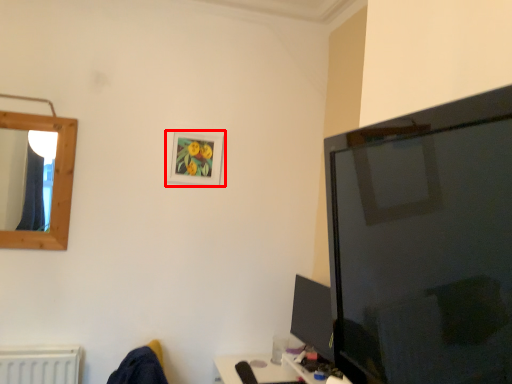
Question: Considering the relative positions of picture frame (annotated by the red box) and tv show in the image provided, where is picture frame (annotated by the red box) located with respect to the staircase?

Choices:
 (A) left
 (B) right

Answer: (A)